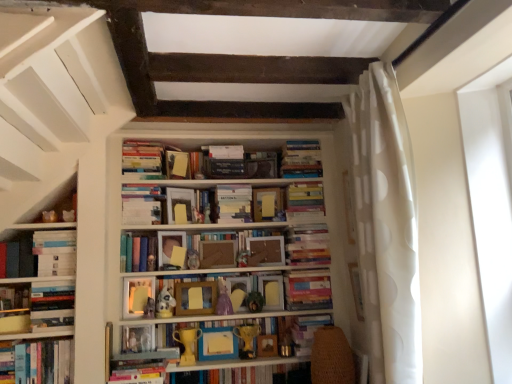
Question: Is hardcover books at center, the 9th book when ordered from bottom to top, smaller than white matte bookshelf at center?

Choices:
 (A) no
 (B) yes

Answer: (B)

Question: Considering the relative positions of hardcover books at center, the 9th book when ordered from bottom to top, and white matte bookshelf at center in the image provided, is hardcover books at center, the 9th book when ordered from bottom to top, in front of white matte bookshelf at center?

Choices:
 (A) no
 (B) yes

Answer: (A)

Question: Is hardcover books at center, acting as the 2th book starting from the top, facing towards white matte bookshelf at center?

Choices:
 (A) yes
 (B) no

Answer: (A)

Question: Could white matte bookshelf at center be considered to be inside hardcover books at center, the 9th book when ordered from bottom to top?

Choices:
 (A) yes
 (B) no

Answer: (B)

Question: Is hardcover books at center, the 9th book when ordered from bottom to top, positioned beyond the bounds of white matte bookshelf at center?

Choices:
 (A) yes
 (B) no

Answer: (B)

Question: Is wooden frame at center, which is counted as the seventh book, starting from the top, in front of or behind white matte bookshelf at center in the image?

Choices:
 (A) front
 (B) behind

Answer: (B)

Question: In terms of width, does wooden frame at center, which is counted as the seventh book, starting from the top, look wider or thinner when compared to white matte bookshelf at center?

Choices:
 (A) wide
 (B) thin

Answer: (B)

Question: From the image's perspective, is wooden frame at center, the 4th book in the bottom-to-top sequence, located above or below white matte bookshelf at center?

Choices:
 (A) above
 (B) below

Answer: (B)

Question: Is wooden frame at center, the 4th book in the bottom-to-top sequence, inside or outside of white matte bookshelf at center?

Choices:
 (A) outside
 (B) inside

Answer: (B)

Question: From the image's perspective, is matte paper book at center, placed as the eleventh paperback book when sorted from bottom to top, located above or below hardcover book at center, the 4th book from the top?

Choices:
 (A) above
 (B) below

Answer: (A)

Question: In the image, is matte paper book at center, the 5th paperback book when ordered from top to bottom, positioned in front of or behind hardcover book at center, the seventh book when ordered from bottom to top?

Choices:
 (A) behind
 (B) front

Answer: (A)

Question: From a real-world perspective, is matte paper book at center, placed as the eleventh paperback book when sorted from bottom to top, above or below hardcover book at center, the 4th book from the top?

Choices:
 (A) below
 (B) above

Answer: (B)

Question: Do you think matte paper book at center, the 5th paperback book when ordered from top to bottom, is within hardcover book at center, the seventh book when ordered from bottom to top, or outside of it?

Choices:
 (A) outside
 (B) inside

Answer: (A)

Question: From the image's perspective, is white matte bookshelf at center located above or below matte plastic toy at center, the 3th toy in the right-to-left sequence?

Choices:
 (A) above
 (B) below

Answer: (A)

Question: From a real-world perspective, is white matte bookshelf at center positioned above or below matte plastic toy at center, the 3th toy in the right-to-left sequence?

Choices:
 (A) below
 (B) above

Answer: (B)